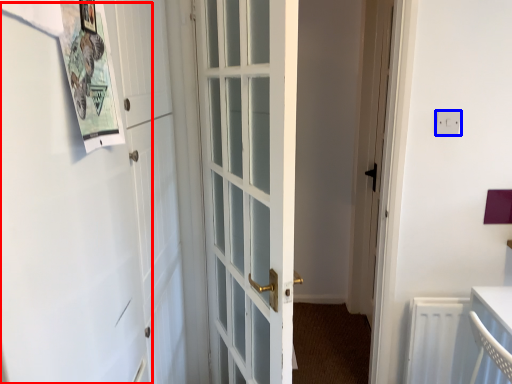
Question: Which of the following is the farthest to the observer, barn door (highlighted by a red box) or electric outlet (highlighted by a blue box)?

Choices:
 (A) barn door
 (B) electric outlet

Answer: (B)